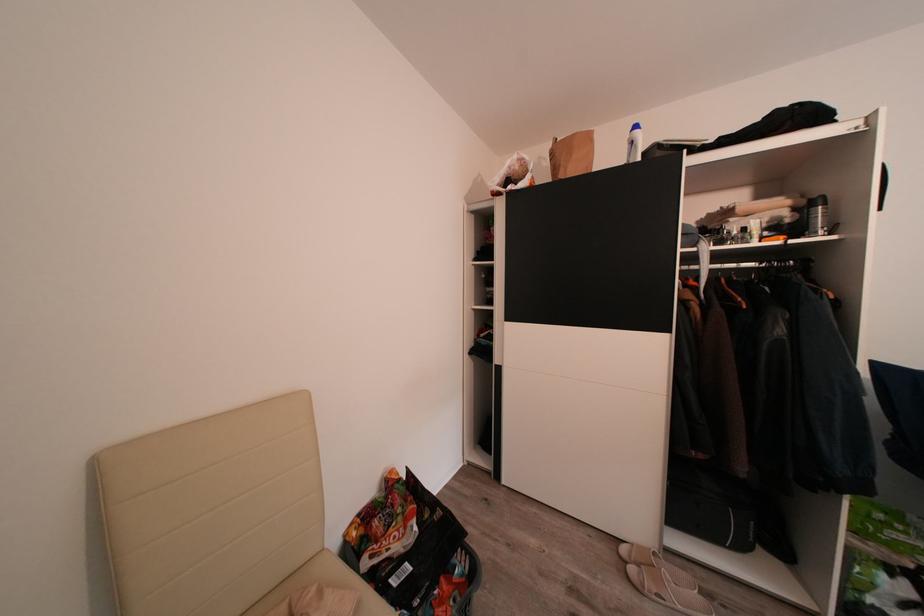
The location [411,549] corresponds to which object?

It corresponds to the black laundry basket in the image.